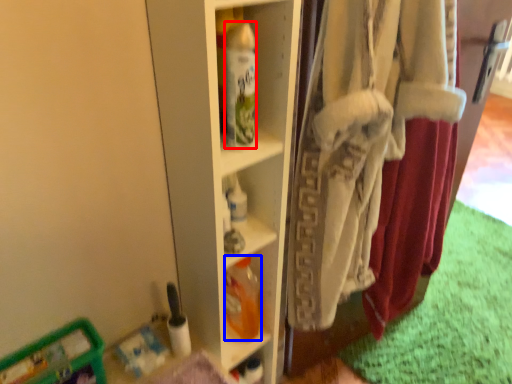
Question: Which of the following is the farthest to the observer, bottle (highlighted by a red box) or bottle (highlighted by a blue box)?

Choices:
 (A) bottle
 (B) bottle

Answer: (B)